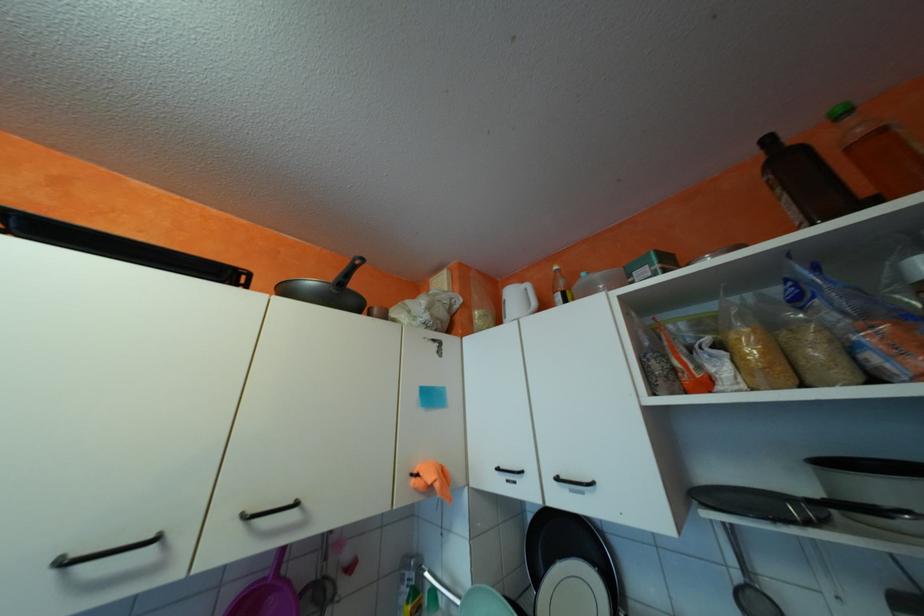
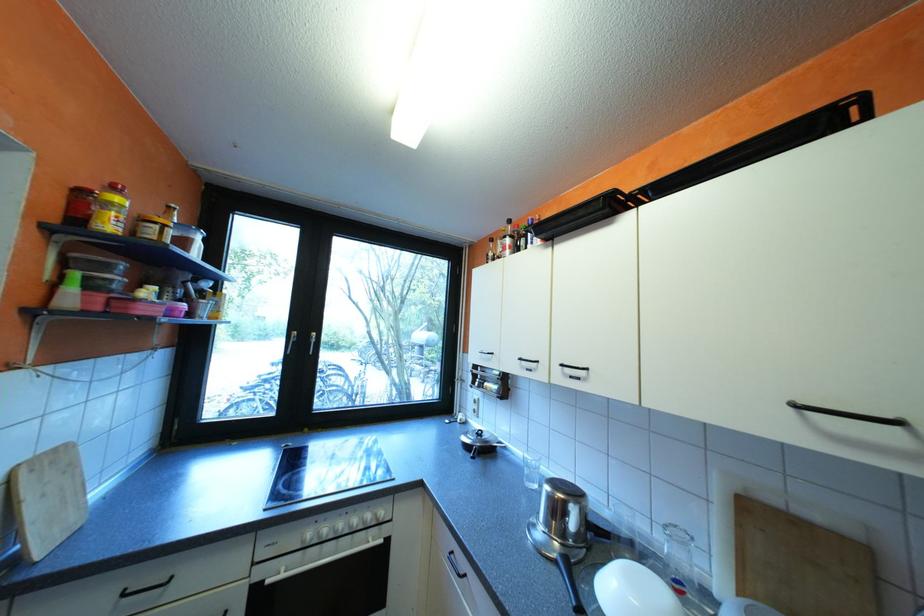
Question: The camera is either moving clockwise (left) or counter-clockwise (right) around the object. The first image is from the beginning of the video and the second image is from the end. Is the camera moving left or right when shooting the video?

Choices:
 (A) Left
 (B) Right

Answer: (B)